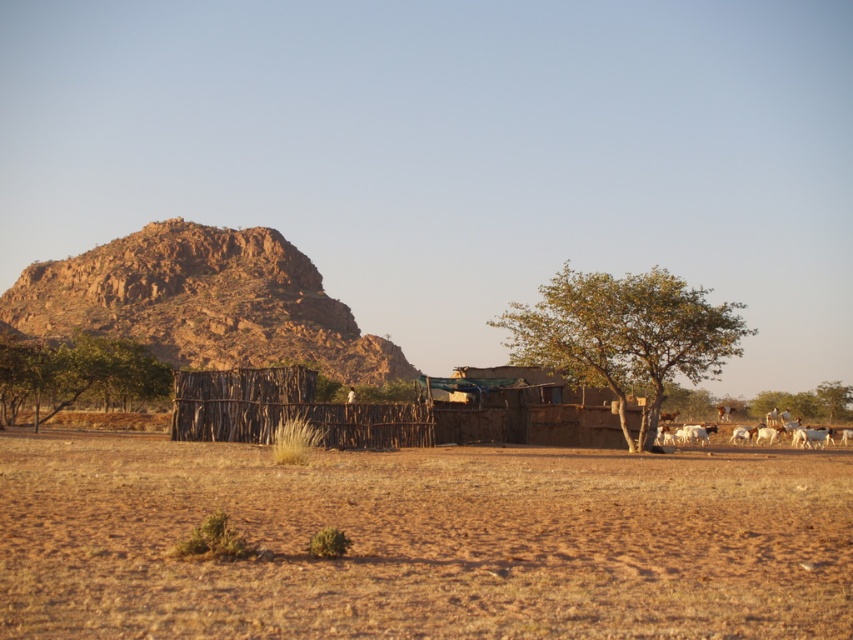
You are a hiker trying to navigate through the dry field. You see the rustic rock formation at upper left and the green leafy tree at left. Which one is higher up in the image?

The rustic rock formation at upper left is positioned over the green leafy tree at left, so it is higher up in the image.

Consider the image. You are a farmer who wants to water the green leafy tree at center using a hose that can reach 10 meters. The white woolly goats at right are grazing nearby. If the tree is 5 meters away from the fence, and the fence is 3 meters away from the goats, can you water the tree without the goats getting in the way?

The green leafy tree at center is in front of the white woolly goats at right, meaning the tree is closer to you than the goats. Since the tree is 5 meters from the fence and the fence is 3 meters from the goats, the total distance from you to the goats is 8 meters. The hose can reach 10 meters, so you can water the tree without the goats interfering as they are farther away.

You are standing in the middle of the dry field and see two green leafy trees. Which tree, the green leafy tree at center or the green leafy tree at left, is positioned to the right of the other?

The green leafy tree at center is positioned to the right of the green leafy tree at left.